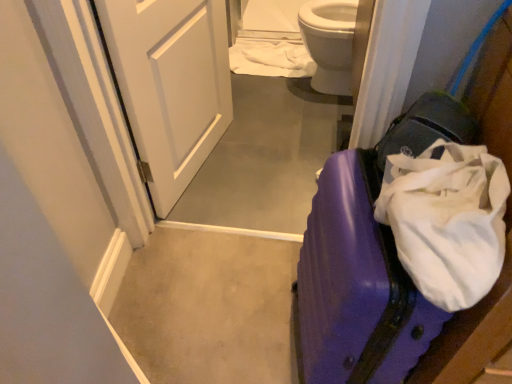
Question: Is purple glossy suitcase at lower right positioned far away from white fabric at upper center?

Choices:
 (A) yes
 (B) no

Answer: (A)

Question: Is the depth of purple glossy suitcase at lower right greater than that of white fabric at upper center?

Choices:
 (A) no
 (B) yes

Answer: (A)

Question: Does purple glossy suitcase at lower right have a larger size compared to white fabric at upper center?

Choices:
 (A) yes
 (B) no

Answer: (A)

Question: Is purple glossy suitcase at lower right placed right next to white fabric at upper center?

Choices:
 (A) yes
 (B) no

Answer: (B)

Question: Considering the relative positions of purple glossy suitcase at lower right and white fabric at upper center in the image provided, is purple glossy suitcase at lower right to the right of white fabric at upper center from the viewer's perspective?

Choices:
 (A) no
 (B) yes

Answer: (B)

Question: Is white fabric at upper center located within purple glossy suitcase at lower right?

Choices:
 (A) no
 (B) yes

Answer: (A)

Question: From a real-world perspective, is white glossy door at upper left positioned over white fabric at upper center based on gravity?

Choices:
 (A) yes
 (B) no

Answer: (A)

Question: Is white glossy door at upper left directly adjacent to white fabric at upper center?

Choices:
 (A) yes
 (B) no

Answer: (B)

Question: Considering the relative sizes of white glossy door at upper left and white fabric at upper center in the image provided, is white glossy door at upper left wider than white fabric at upper center?

Choices:
 (A) yes
 (B) no

Answer: (B)

Question: Is white glossy door at upper left oriented away from white fabric at upper center?

Choices:
 (A) no
 (B) yes

Answer: (A)

Question: From the image's perspective, is white glossy door at upper left beneath white fabric at upper center?

Choices:
 (A) no
 (B) yes

Answer: (B)

Question: Is white glossy door at upper left located outside white fabric at upper center?

Choices:
 (A) yes
 (B) no

Answer: (A)

Question: Is white glossy door at upper left inside white fabric at upper center?

Choices:
 (A) yes
 (B) no

Answer: (B)